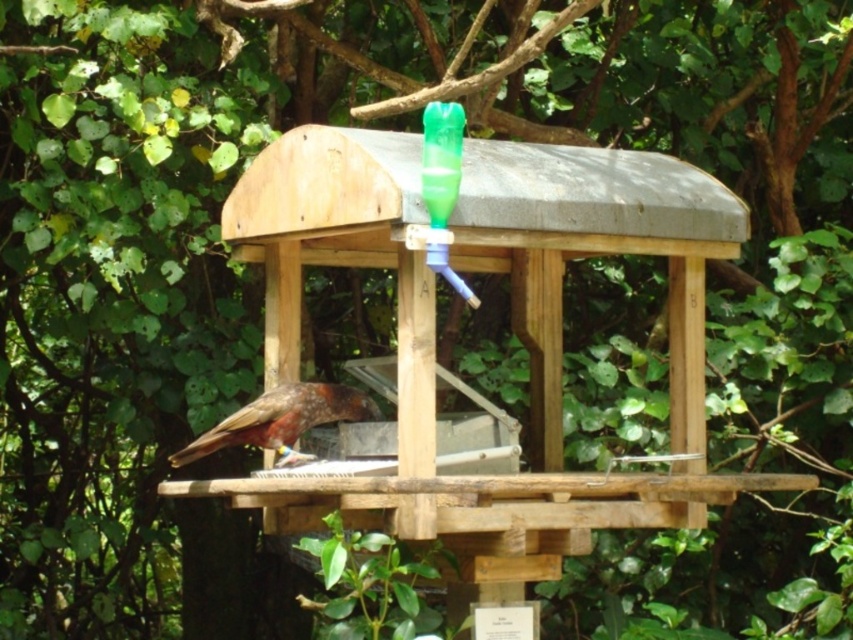
You are a birdwatcher observing the wooden bird feeder. You notice a bird with brown speckled feathers at center. Where exactly is the bird located in the image?

The brown speckled feathers at center is located at point (282, 420).

You are a small bird with a wingspan of 12 inches. You want to fly from the brown speckled feathers at center to the green translucent bottle at upper center. Can you make the flight without flapping your wings? Explain your reasoning based on the distance between them.

The distance between the brown speckled feathers at center and the green translucent bottle at upper center is 14.97 inches. Since your wingspan is 12 inches, you would need to flap your wings to cover the extra distance beyond your wingspan. Therefore, you cannot make the flight without flapping your wings.